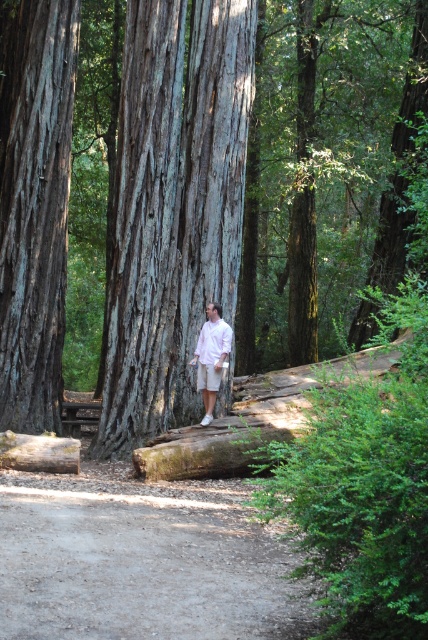
Based on the photo, is smooth gray bark at center below dirt path at lower center?

No.

Measure the distance between smooth gray bark at center and dirt path at lower center.

smooth gray bark at center is 69.21 feet away from dirt path at lower center.

Is point (344, 266) positioned before point (261, 604)?

No, (344, 266) is behind (261, 604).

Identify the location of smooth gray bark at center. This screenshot has width=428, height=640. (241, 188).

Which is more to the left, dirt path at lower center or smooth brown tree trunk at left?

Positioned to the left is smooth brown tree trunk at left.

At what (x,y) coordinates should I click in order to perform the action: click on dirt path at lower center. Please return your answer as a coordinate pair (x, y). Looking at the image, I should click on (142, 563).

Where is `dirt path at lower center`? The width and height of the screenshot is (428, 640). dirt path at lower center is located at coordinates (142, 563).

The width and height of the screenshot is (428, 640). Find the location of `dirt path at lower center`. dirt path at lower center is located at coordinates (142, 563).

Who is positioned more to the left, smooth gray bark at center or smooth brown tree trunk at left?

From the viewer's perspective, smooth brown tree trunk at left appears more on the left side.

Does smooth gray bark at center appear on the left side of smooth brown tree trunk at left?

Incorrect, smooth gray bark at center is not on the left side of smooth brown tree trunk at left.

The width and height of the screenshot is (428, 640). What do you see at coordinates (241, 188) in the screenshot? I see `smooth gray bark at center` at bounding box center [241, 188].

Locate an element on the screen. smooth gray bark at center is located at coordinates (241, 188).